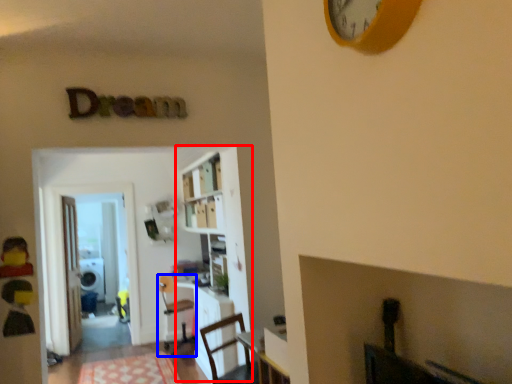
Question: Which of the following is the closest to the observer, bookcase (highlighted by a red box) or chair (highlighted by a blue box)?

Choices:
 (A) bookcase
 (B) chair

Answer: (A)